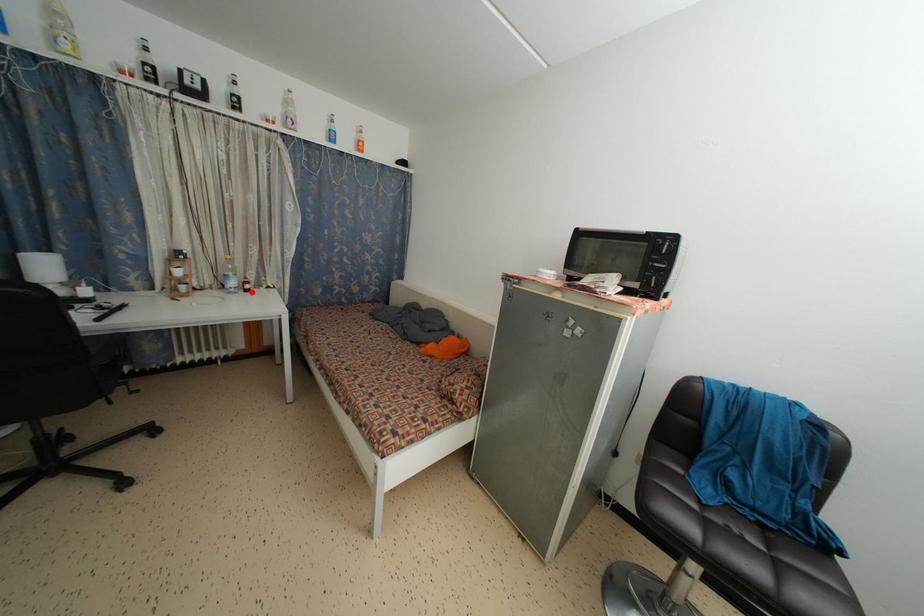
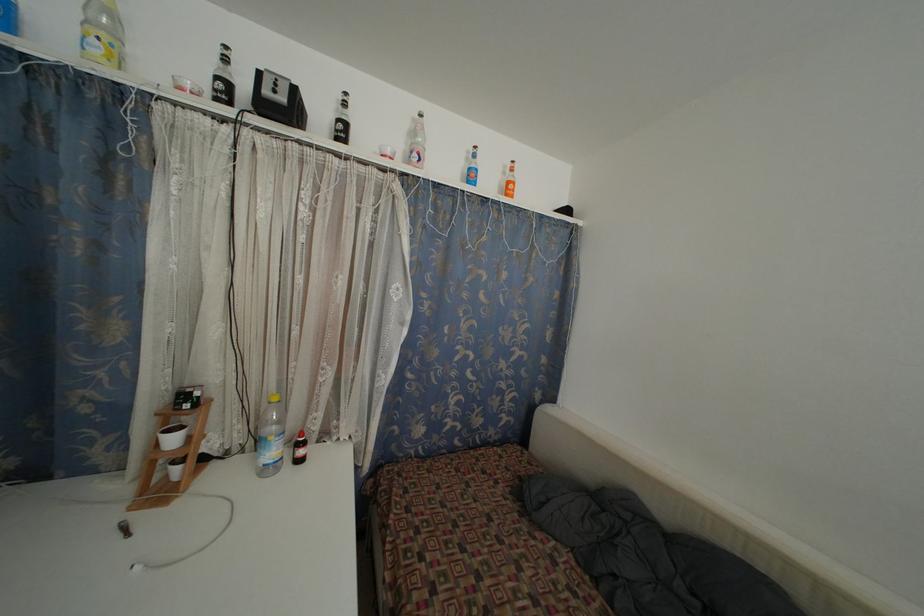
Find the pixel in the second image that matches the highlighted location in the first image.

(305, 458)